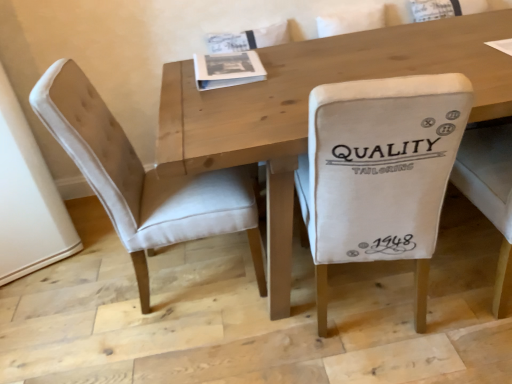
Question: Is white paper book at center surrounded by wooden table at center?

Choices:
 (A) no
 (B) yes

Answer: (B)

Question: Considering the relative positions of wooden table at center and white paper book at center in the image provided, is wooden table at center behind white paper book at center?

Choices:
 (A) no
 (B) yes

Answer: (A)

Question: Does wooden table at center have a lesser width compared to white paper book at center?

Choices:
 (A) no
 (B) yes

Answer: (A)

Question: Is wooden table at center closer to the viewer compared to white paper book at center?

Choices:
 (A) no
 (B) yes

Answer: (B)

Question: From a real-world perspective, is wooden table at center positioned under white paper book at center based on gravity?

Choices:
 (A) yes
 (B) no

Answer: (A)

Question: From the image's perspective, is wooden table at center under white paper book at center?

Choices:
 (A) no
 (B) yes

Answer: (B)

Question: From the image's perspective, is white paper book at center under beige fabric chair at left, the 2th chair in the right-to-left sequence?

Choices:
 (A) no
 (B) yes

Answer: (A)

Question: Considering the relative sizes of white paper book at center and beige fabric chair at left, the 1th chair in the left-to-right sequence, in the image provided, is white paper book at center taller than beige fabric chair at left, the 1th chair in the left-to-right sequence,?

Choices:
 (A) no
 (B) yes

Answer: (A)

Question: Does white paper book at center contain beige fabric chair at left, the 1th chair in the left-to-right sequence?

Choices:
 (A) yes
 (B) no

Answer: (B)

Question: Is white paper book at center further to camera compared to beige fabric chair at left, the 2th chair in the right-to-left sequence?

Choices:
 (A) no
 (B) yes

Answer: (B)

Question: Can you confirm if white paper book at center is wider than beige fabric chair at left, the 1th chair in the left-to-right sequence?

Choices:
 (A) no
 (B) yes

Answer: (A)

Question: Could you tell me if white paper book at center is turned towards beige fabric chair at left, the 2th chair in the right-to-left sequence?

Choices:
 (A) no
 (B) yes

Answer: (B)

Question: Could white paper book at center be considered to be inside white fabric chair at center, the 2th chair when ordered from left to right?

Choices:
 (A) no
 (B) yes

Answer: (A)